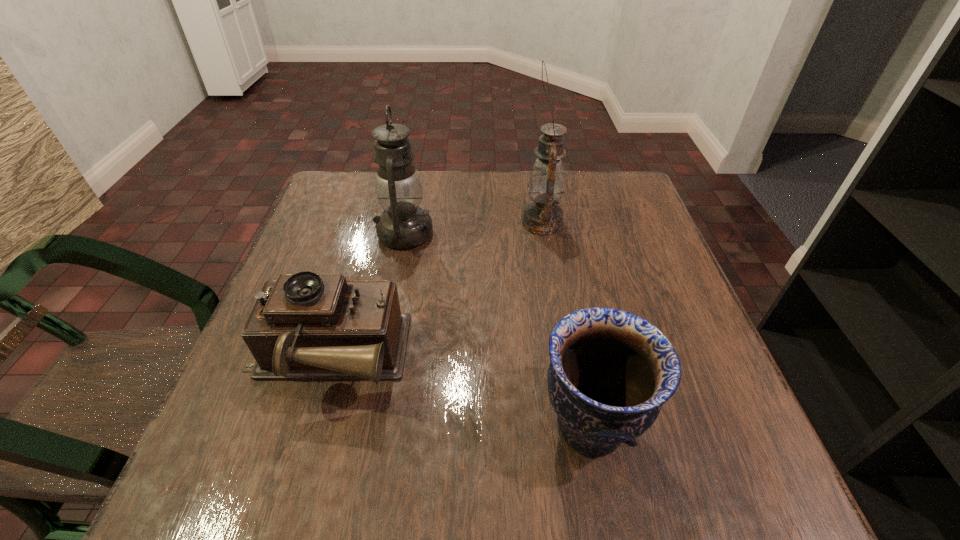
Identify the location of blank area at the near left corner. (289, 449).

The height and width of the screenshot is (540, 960). Find the location of `vacant region at the far right corner`. vacant region at the far right corner is located at coordinates (592, 193).

I want to click on vacant area that lies between the pottery and the shortest object, so click(x=458, y=392).

Locate an element on the screen. The width and height of the screenshot is (960, 540). free space between the pottery and the phonograph_record is located at coordinates (458, 392).

This screenshot has height=540, width=960. In order to click on free space between the shorter oil lamp and the taller oil lamp in this screenshot , I will do tap(473, 228).

Find the location of a particular element. vacant space that's between the taller oil lamp and the shortest object is located at coordinates (434, 290).

Where is `free spot between the pottery and the phonograph_record`? Image resolution: width=960 pixels, height=540 pixels. free spot between the pottery and the phonograph_record is located at coordinates (458, 392).

I want to click on unoccupied position between the pottery and the shorter oil lamp, so [x=497, y=329].

Choose which object is the second nearest neighbor to the right oil lamp. Please provide its 2D coordinates. Your answer should be formatted as a tuple, i.e. [(x, y)], where the tuple contains the x and y coordinates of a point satisfying the conditions above.

[(306, 326)]

The height and width of the screenshot is (540, 960). In order to click on object that can be found as the third closest to the phonograph_record in this screenshot , I will do `click(546, 184)`.